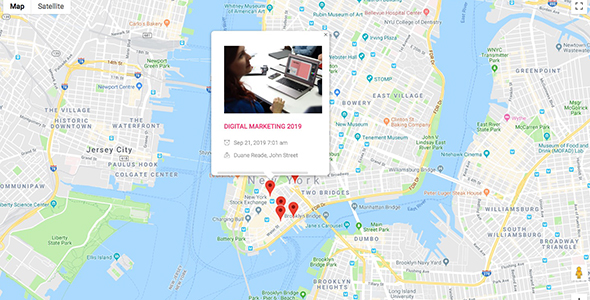
In order to click on picture in this screenshot , I will do `click(264, 80)`.